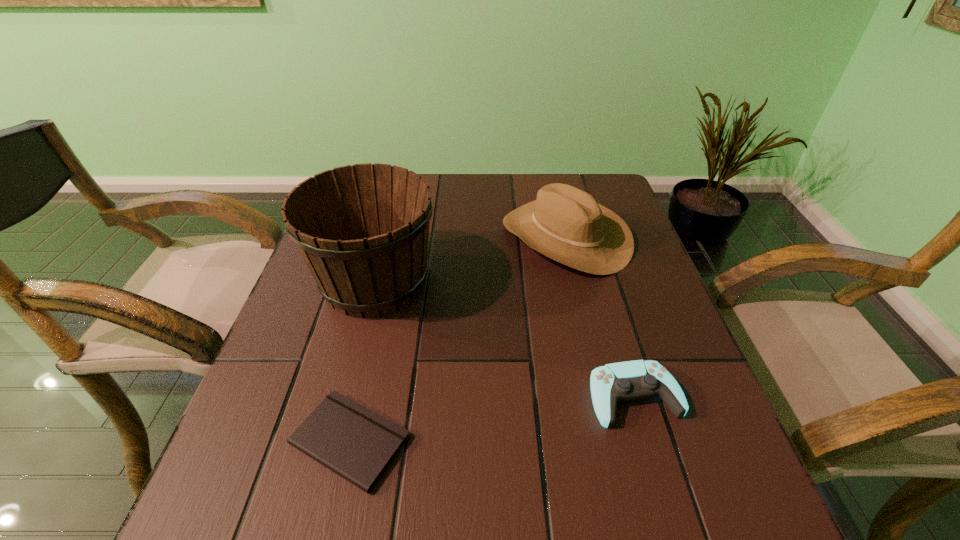
Image resolution: width=960 pixels, height=540 pixels. What are the coordinates of `the tallest object` in the screenshot? It's located at (363, 230).

At what (x,y) coordinates should I click in order to perform the action: click on the third shortest object. Please return your answer as a coordinate pair (x, y). This screenshot has height=540, width=960. Looking at the image, I should click on (566, 224).

Find the location of `control`. control is located at coordinates (624, 381).

This screenshot has height=540, width=960. What are the coordinates of `the shortest object` in the screenshot? It's located at (351, 440).

The width and height of the screenshot is (960, 540). Identify the location of vacant space located on the front of the wine bucket. (310, 531).

Find the location of a particular element. Image resolution: width=960 pixels, height=540 pixels. vacant area situated 0.110m on the back of the cowboy hat is located at coordinates (553, 183).

In order to click on vacant region located 0.390m on the left of the third tallest object in this screenshot , I will do `click(372, 397)`.

Where is `free space located 0.050m on the left of the shortest object`? This screenshot has height=540, width=960. free space located 0.050m on the left of the shortest object is located at coordinates (260, 441).

Locate an element on the screen. The height and width of the screenshot is (540, 960). object located in the far edge section of the desktop is located at coordinates (566, 224).

At what (x,y) coordinates should I click in order to perform the action: click on object positioned at the near edge. Please return your answer as a coordinate pair (x, y). This screenshot has height=540, width=960. Looking at the image, I should click on (351, 440).